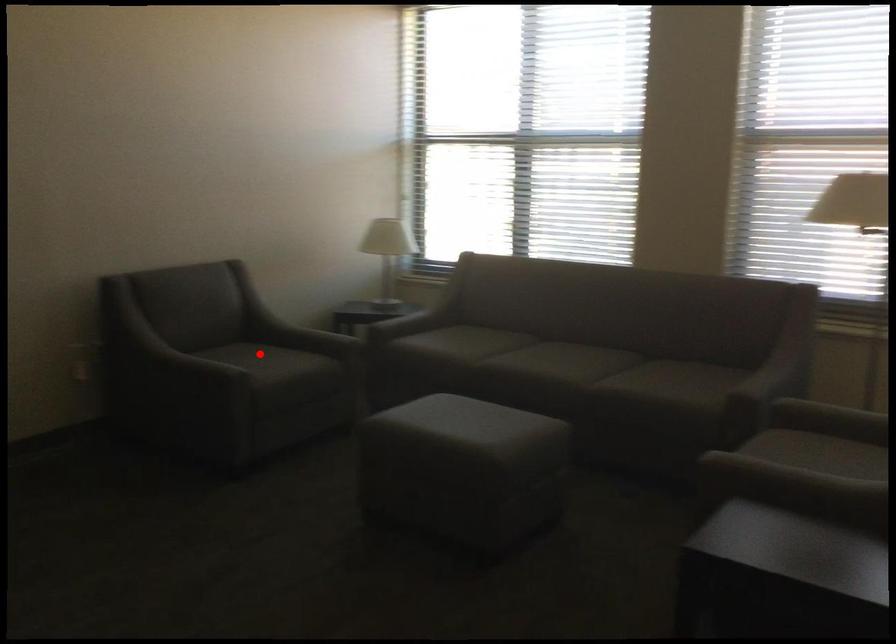
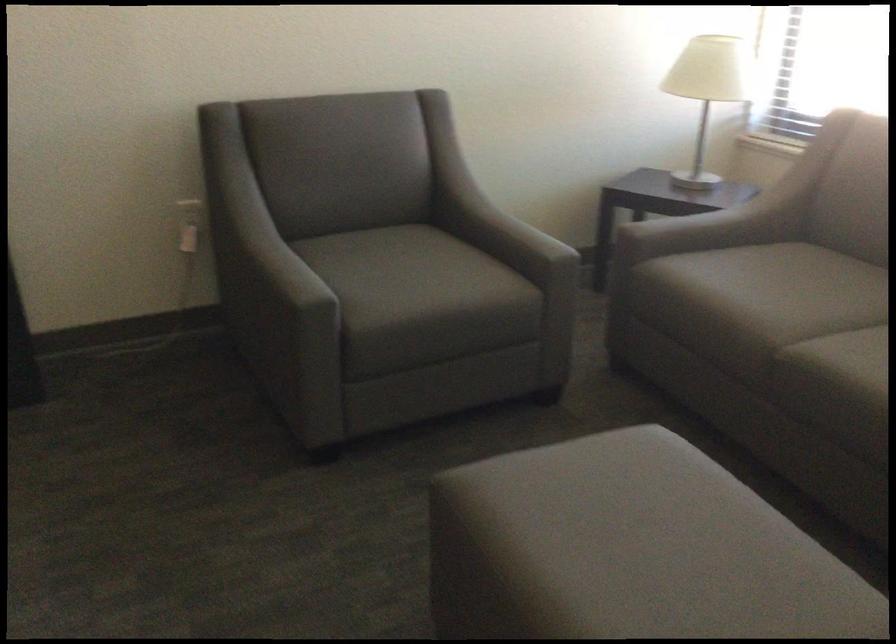
Question: I am providing you with two images of the same scene from different viewpoints. A red point is shown in image1. For the corresponding object point in image2, is it positioned nearer or farther from the camera?

Choices:
 (A) Nearer
 (B) Farther

Answer: (A)